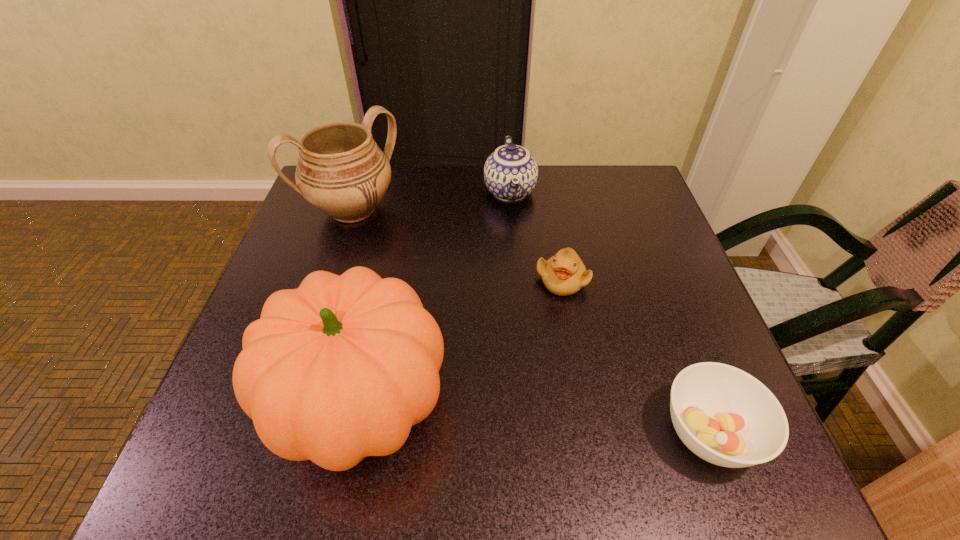
You are a GUI agent. You are given a task and a screenshot of the screen. Output one action in this format:
    pyautogui.click(x=<x>, y=<y>)
    Task: Click on the empty space between the urn and the rightmost object
    Image resolution: width=960 pixels, height=540 pixels.
    Given the screenshot: What is the action you would take?
    pyautogui.click(x=531, y=321)

At what (x,y) coordinates should I click in order to perform the action: click on vacant area that lies between the duckling and the urn. Please return your answer as a coordinate pair (x, y). Looking at the image, I should click on (x=458, y=245).

Identify the location of free space between the pumpkin and the duckling. This screenshot has width=960, height=540. (462, 342).

Find the location of a particular element. vacant area that lies between the chinaware and the duckling is located at coordinates (x=536, y=235).

Find the location of a particular element. vacant space that's between the rightmost object and the duckling is located at coordinates tap(636, 356).

You are a GUI agent. You are given a task and a screenshot of the screen. Output one action in this format:
    pyautogui.click(x=<x>, y=<y>)
    Task: Click on the vacant space that's between the soup bowl and the third farthest object
    The width and height of the screenshot is (960, 540).
    Given the screenshot: What is the action you would take?
    pyautogui.click(x=636, y=356)

Locate an element on the screen. vacant region between the third farthest object and the pumpkin is located at coordinates (462, 342).

Identify the location of vacant area that lies between the third tallest object and the urn. Image resolution: width=960 pixels, height=540 pixels. (431, 201).

The width and height of the screenshot is (960, 540). I want to click on free space that is in between the chinaware and the urn, so click(431, 201).

You are a GUI agent. You are given a task and a screenshot of the screen. Output one action in this format:
    pyautogui.click(x=<x>, y=<y>)
    Task: Click on the object that stands as the closest to the third nearest object
    This screenshot has height=540, width=960.
    Given the screenshot: What is the action you would take?
    pyautogui.click(x=510, y=173)